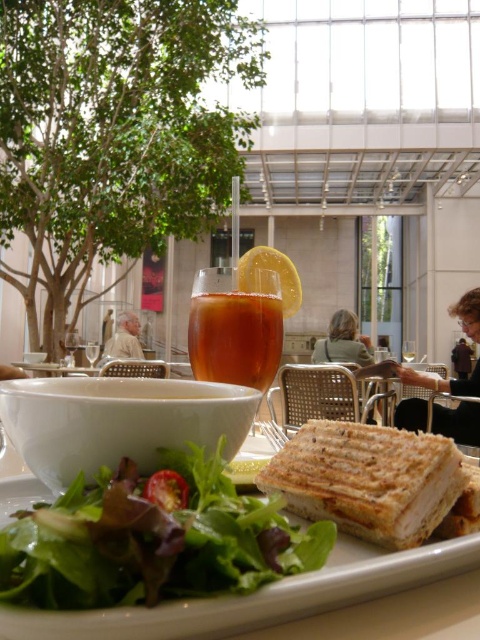
Question: Does translucent amber liquid at center appear on the left side of green fabric jacket at center?

Choices:
 (A) yes
 (B) no

Answer: (A)

Question: Among these points, which one is nearest to the camera?

Choices:
 (A) (470, 483)
 (B) (474, 330)
 (C) (78, 492)
 (D) (369, 468)

Answer: (C)

Question: Which object is positioned farthest from the green leafy salad at center?

Choices:
 (A) green fabric jacket at center
 (B) golden brown toasted sandwich at center
 (C) matte white shirt at center
 (D) translucent amber liquid at center

Answer: (C)

Question: Which point is farther from the camera taking this photo?

Choices:
 (A) (113, 342)
 (B) (478, 524)

Answer: (A)

Question: Is green leafy salad at center smaller than translucent amber liquid at center?

Choices:
 (A) no
 (B) yes

Answer: (A)

Question: Where is golden brown toasted sandwich at center located in relation to green fabric jacket at center in the image?

Choices:
 (A) above
 (B) below

Answer: (A)